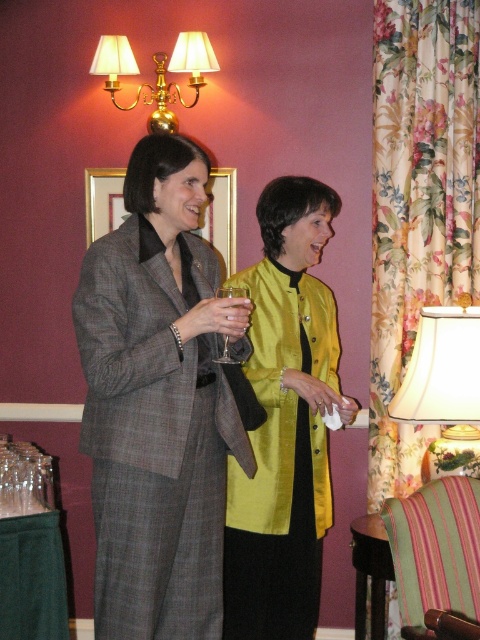
You are standing in the center of the room and want to hand a gift to the woman wearing the silky yellow blouse at center. Which direction should you move to reach her?

The silky yellow blouse at center is located at point (285, 420), so you should move towards the direction of the coordinates to reach her.

You are a photographer standing in the room where the two women are. You want to take a photo that includes both women and the floral fabric curtain at right. Given that the camera you are using has a maximum focus range of 3 meters, will you be able to capture the curtain clearly in the photo?

The floral fabric curtain at right is 3.19 meters from viewer. Since the camera can only focus up to 3 meters, the curtain will be slightly out of focus and not captured clearly.

You are at the center of the image and want to move towards the silky yellow blouse at center. Which direction should you move?

Since the silky yellow blouse at center is located at point (285,420), you should move towards the right and slightly downward to reach it.